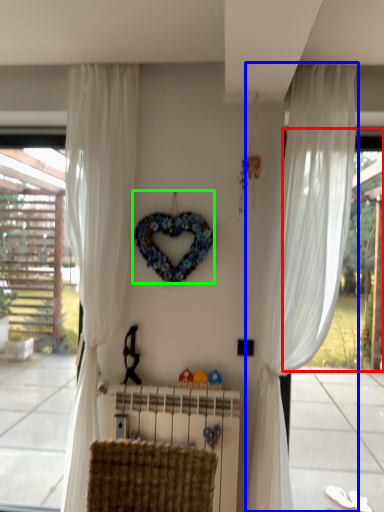
Question: Considering the real-world distances, which object is farthest from window screen (highlighted by a red box)? curtain (highlighted by a blue box) or wreath (highlighted by a green box)?

Choices:
 (A) curtain
 (B) wreath

Answer: (B)